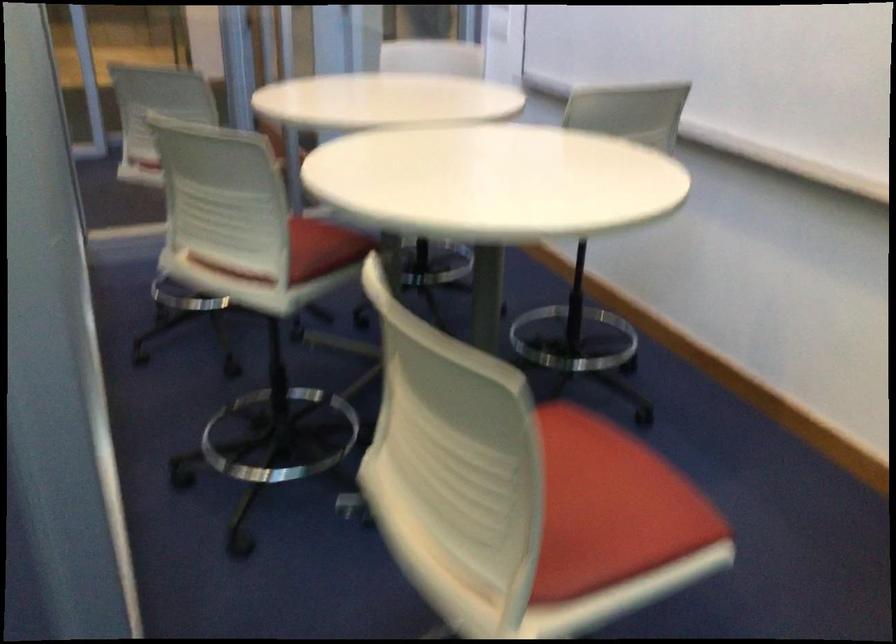
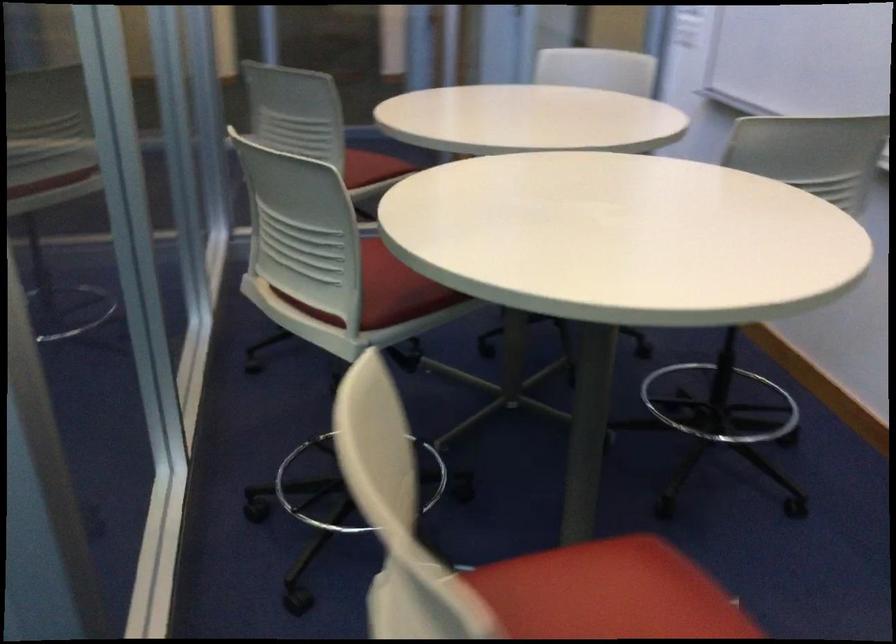
Question: The images are taken continuously from a first-person perspective. In which direction is your viewpoint rotating?

Choices:
 (A) Left
 (B) Right
 (C) Up
 (D) Down

Answer: (A)